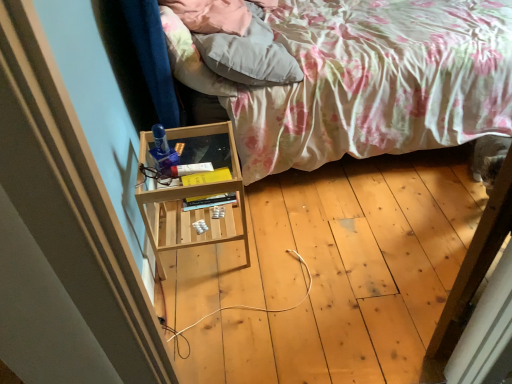
Question: From a real-world perspective, relative to fluffy white pillow at upper center, is floral fabric bed at center vertically above or below?

Choices:
 (A) below
 (B) above

Answer: (A)

Question: Considering the positions of floral fabric bed at center and fluffy white pillow at upper center in the image, is floral fabric bed at center taller or shorter than fluffy white pillow at upper center?

Choices:
 (A) short
 (B) tall

Answer: (B)

Question: Considering their positions, is floral fabric bed at center located in front of or behind fluffy white pillow at upper center?

Choices:
 (A) behind
 (B) front

Answer: (B)

Question: Based on their positions, is fluffy white pillow at upper center located to the left or right of floral fabric bed at center?

Choices:
 (A) right
 (B) left

Answer: (B)

Question: Is point (291, 74) positioned closer to the camera than point (269, 129)?

Choices:
 (A) closer
 (B) farther

Answer: (A)

Question: Looking at their shapes, would you say fluffy white pillow at upper center is wider or thinner than floral fabric bed at center?

Choices:
 (A) thin
 (B) wide

Answer: (A)

Question: Is fluffy white pillow at upper center bigger or smaller than floral fabric bed at center?

Choices:
 (A) big
 (B) small

Answer: (B)